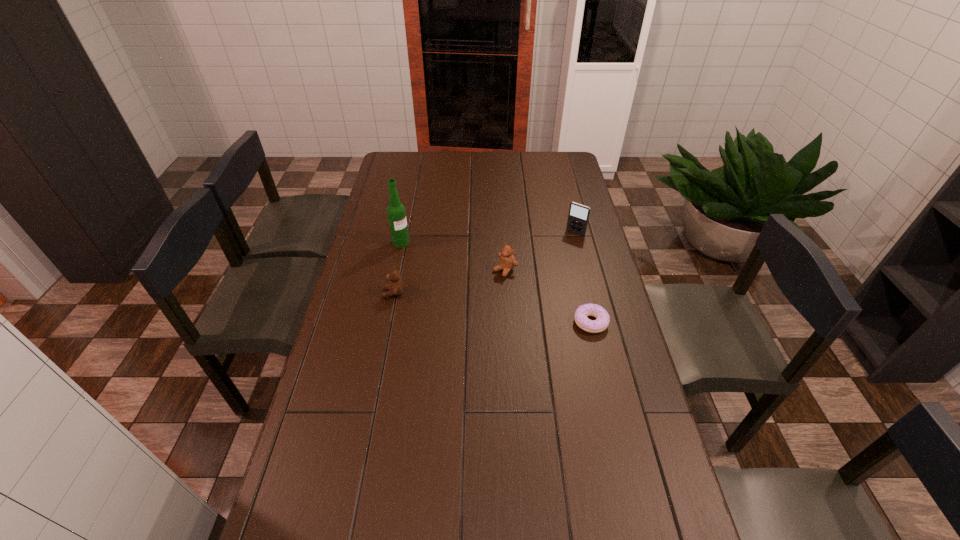
Locate an element on the screen. vacant space on the desktop that is between the second nearest object and the nearest object and is positioned on the front-facing side of the farthest object is located at coordinates (516, 312).

This screenshot has height=540, width=960. I want to click on free spot on the desktop that is between the nearer teddy bear and the nearest object and is positioned on the face of the third object from left to right, so click(x=464, y=303).

I want to click on vacant spot on the desktop that is between the left teddy bear and the shortest object and is positioned on the label of the tallest object, so click(494, 308).